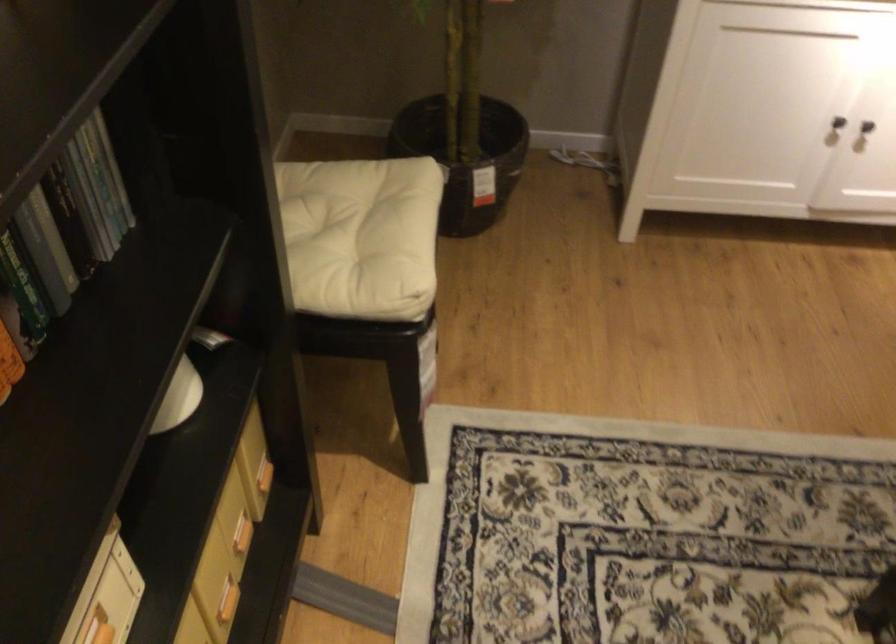
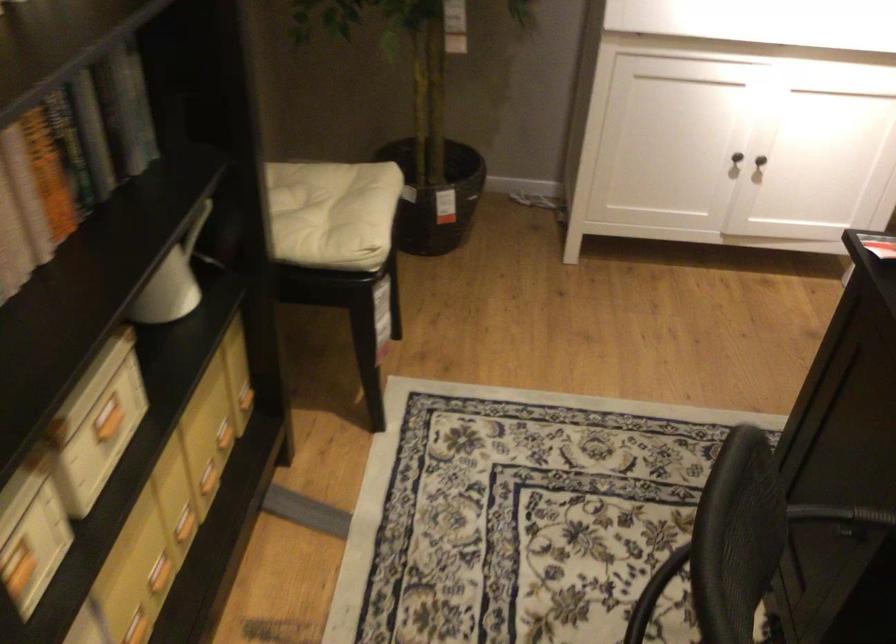
In a continuous first-person perspective shot, in which direction is the camera moving?

The cameraman moved toward right, backward.